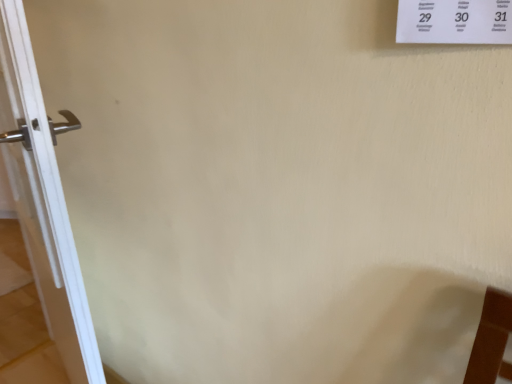
Question: Is white paper at upper right to the left of white glossy door handle at left from the viewer's perspective?

Choices:
 (A) no
 (B) yes

Answer: (A)

Question: Does white paper at upper right lie in front of white glossy door handle at left?

Choices:
 (A) yes
 (B) no

Answer: (A)

Question: Is white paper at upper right oriented towards white glossy door handle at left?

Choices:
 (A) yes
 (B) no

Answer: (B)

Question: From a real-world perspective, does white paper at upper right stand above white glossy door handle at left?

Choices:
 (A) yes
 (B) no

Answer: (A)

Question: Is white paper at upper right thinner than white glossy door handle at left?

Choices:
 (A) yes
 (B) no

Answer: (A)

Question: From the image's perspective, is white paper at upper right over white glossy door handle at left?

Choices:
 (A) no
 (B) yes

Answer: (B)

Question: From a real-world perspective, does white glossy door handle at left stand above white paper at upper right?

Choices:
 (A) no
 (B) yes

Answer: (A)

Question: Does white glossy door handle at left have a greater height compared to white paper at upper right?

Choices:
 (A) no
 (B) yes

Answer: (B)

Question: Does white glossy door handle at left lie in front of white paper at upper right?

Choices:
 (A) yes
 (B) no

Answer: (B)

Question: Does white glossy door handle at left have a smaller size compared to white paper at upper right?

Choices:
 (A) no
 (B) yes

Answer: (A)

Question: Does white glossy door handle at left have a larger size compared to white paper at upper right?

Choices:
 (A) no
 (B) yes

Answer: (B)

Question: Is white glossy door handle at left surrounding white paper at upper right?

Choices:
 (A) yes
 (B) no

Answer: (B)

Question: Visually, is white paper at upper right positioned to the left or to the right of white glossy door handle at left?

Choices:
 (A) right
 (B) left

Answer: (A)